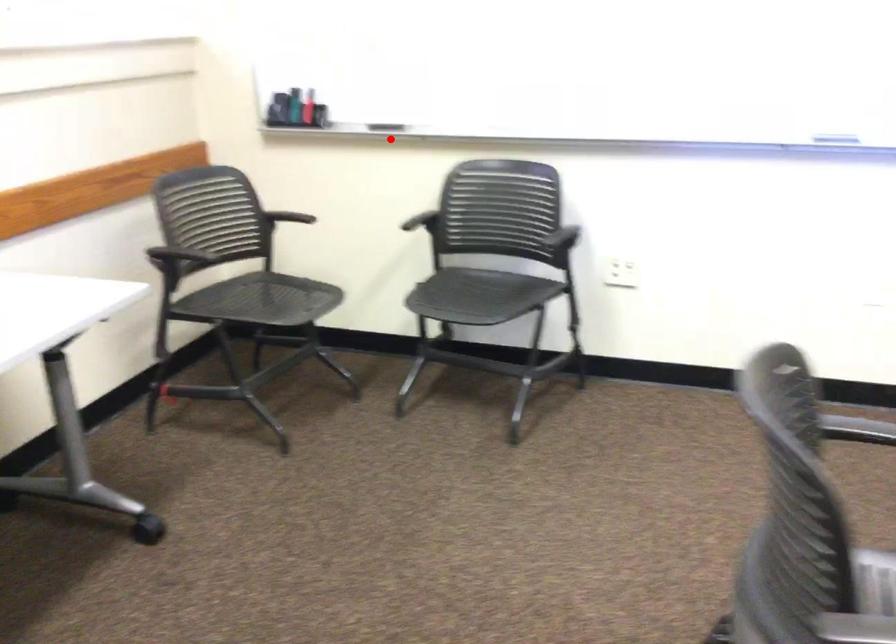
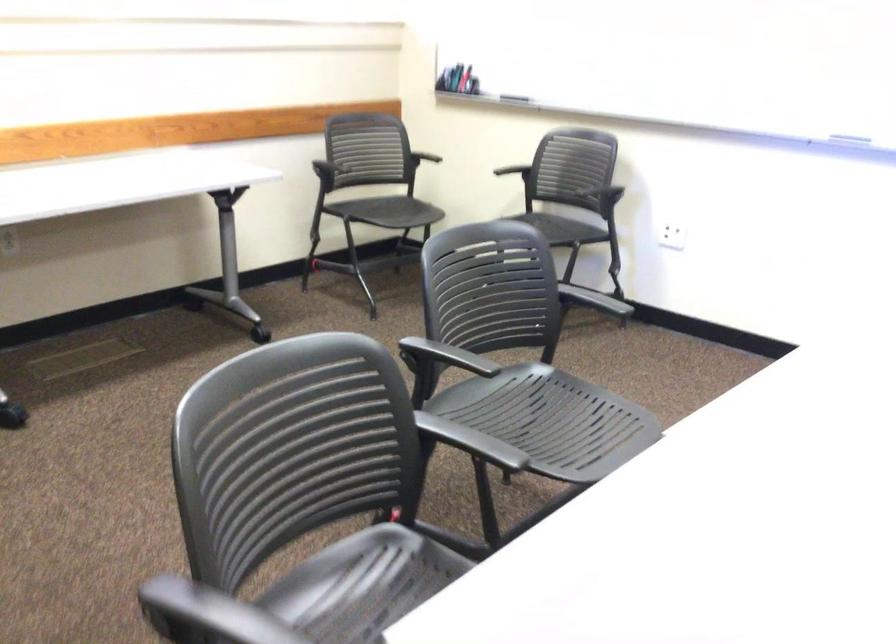
In the second image, find the point that corresponds to the highlighted location in the first image.

(514, 98)